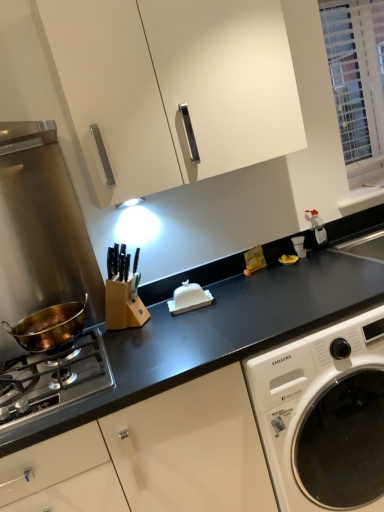
Describe the element at coordinates (174, 87) in the screenshot. Image resolution: width=384 pixels, height=512 pixels. I see `white matte cabinet at upper center` at that location.

Locate an element on the screen. This screenshot has height=512, width=384. bronze metallic wok at left is located at coordinates [49, 326].

This screenshot has width=384, height=512. I want to click on white textured blinds at upper right, so click(x=356, y=82).

What do you see at coordinates (189, 298) in the screenshot? This screenshot has width=384, height=512. I see `white glossy butter dish at center` at bounding box center [189, 298].

I want to click on white matte cabinet at upper center, so click(174, 87).

In the scene shown: Is white glossy washing machine at lower right positioned behind bronze metallic wok at left?

No, white glossy washing machine at lower right is closer to the viewer.

Between white glossy washing machine at lower right and bronze metallic wok at left, which one has smaller width?

bronze metallic wok at left is thinner.

Is white glossy washing machine at lower right oriented towards bronze metallic wok at left?

No, white glossy washing machine at lower right is not oriented towards bronze metallic wok at left.

From a real-world perspective, which is physically above, bronze metallic pan at lower left or white glossy butter dish at center?

white glossy butter dish at center.

Considering the sizes of objects bronze metallic pan at lower left and white glossy butter dish at center in the image provided, who is taller, bronze metallic pan at lower left or white glossy butter dish at center?

Standing taller between the two is white glossy butter dish at center.

Does point (65, 388) appear closer or farther from the camera than point (187, 294)?

Point (65, 388) appears to be closer to the viewer than point (187, 294).

What are the coordinates of `gas stove below the white glossy butter dish at center (from the image's perspective)` in the screenshot? It's located at (53, 380).

Does white glossy butter dish at center appear on the left side of bronze metallic wok at left?

In fact, white glossy butter dish at center is to the right of bronze metallic wok at left.

In the image, is white glossy butter dish at center positioned in front of or behind bronze metallic wok at left?

white glossy butter dish at center is behind bronze metallic wok at left.

Can you confirm if white glossy butter dish at center is shorter than bronze metallic wok at left?

Indeed, white glossy butter dish at center has a lesser height compared to bronze metallic wok at left.

In terms of width, does white glossy butter dish at center look wider or thinner when compared to bronze metallic wok at left?

white glossy butter dish at center is thinner than bronze metallic wok at left.

Is white glossy butter dish at center facing towards white glossy washing machine at lower right?

No, white glossy butter dish at center is not oriented towards white glossy washing machine at lower right.

What's the angular difference between white glossy butter dish at center and white glossy washing machine at lower right's facing directions?

They differ by 10.4 degrees in their facing directions.

Can white glossy washing machine at lower right be found inside white glossy butter dish at center?

No, white glossy washing machine at lower right is not surrounded by white glossy butter dish at center.

In the image, is bronze metallic wok at left positioned in front of or behind bronze metallic pan at lower left?

Clearly, bronze metallic wok at left is behind bronze metallic pan at lower left.

Would you say bronze metallic wok at left is outside bronze metallic pan at lower left?

That's correct, bronze metallic wok at left is outside of bronze metallic pan at lower left.

Identify the location of gas stove in front of the bronze metallic wok at left. (53, 380).

Is bronze metallic wok at left taller than bronze metallic pan at lower left?

Correct, bronze metallic wok at left is much taller as bronze metallic pan at lower left.

What's the angular difference between white matte cabinet at upper center and white glossy washing machine at lower right's facing directions?

white matte cabinet at upper center and white glossy washing machine at lower right are facing 0.235 degrees away from each other.

Between white matte cabinet at upper center and white glossy washing machine at lower right, which one has larger size?

Bigger between the two is white glossy washing machine at lower right.

Is white matte cabinet at upper center not near white glossy washing machine at lower right?

No, white matte cabinet at upper center is not far away from white glossy washing machine at lower right.

Which point is more distant from viewer, (336, 6) or (40, 349)?

The point (336, 6) is more distant.

Is white textured blinds at upper right aimed at bronze metallic wok at left?

No, white textured blinds at upper right is not oriented towards bronze metallic wok at left.

Which object is closer to the camera, white textured blinds at upper right or bronze metallic wok at left?

bronze metallic wok at left is closer to the camera.

This screenshot has width=384, height=512. I want to click on washing machine directly beneath the bronze metallic wok at left (from a real-world perspective), so click(325, 415).

The height and width of the screenshot is (512, 384). In order to click on gas stove on the left side of white glossy butter dish at center in this screenshot , I will do `click(53, 380)`.

When comparing their distances from white matte cabinet at upper center, does white textured blinds at upper right or bronze metallic wok at left seem further?

Among the two, white textured blinds at upper right is located further to white matte cabinet at upper center.

Estimate the real-world distances between objects in this image. Which object is closer to white glossy washing machine at lower right, bronze metallic wok at left or white textured blinds at upper right?

bronze metallic wok at left.

From the picture: Estimate the real-world distances between objects in this image. Which object is further from white glossy butter dish at center, bronze metallic pan at lower left or white matte cabinet at upper center?

white matte cabinet at upper center lies further to white glossy butter dish at center than the other object.

Estimate the real-world distances between objects in this image. Which object is further from bronze metallic pan at lower left, white matte cabinet at upper center or bronze metallic wok at left?

Among the two, white matte cabinet at upper center is located further to bronze metallic pan at lower left.

Looking at the image, which one is located closer to white textured blinds at upper right, white glossy butter dish at center or bronze metallic wok at left?

Among the two, white glossy butter dish at center is located nearer to white textured blinds at upper right.

From the image, which object appears to be nearer to white glossy washing machine at lower right, bronze metallic wok at left or bronze metallic pan at lower left?

Based on the image, bronze metallic pan at lower left appears to be nearer to white glossy washing machine at lower right.

Which object lies further to the anchor point bronze metallic pan at lower left, white matte cabinet at upper center or white glossy butter dish at center?

white matte cabinet at upper center is positioned further to the anchor bronze metallic pan at lower left.

Consider the image. Considering their positions, is white matte cabinet at upper center positioned closer to white glossy butter dish at center than bronze metallic pan at lower left?

bronze metallic pan at lower left is closer to white glossy butter dish at center.

This screenshot has height=512, width=384. Identify the location of gas stove between bronze metallic wok at left and white glossy butter dish at center. (53, 380).

I want to click on appliance between white matte cabinet at upper center and bronze metallic wok at left from top to bottom, so click(189, 298).

Identify the location of appliance situated between bronze metallic pan at lower left and white glossy washing machine at lower right from left to right. The image size is (384, 512). (189, 298).

Identify the location of gas stove between bronze metallic wok at left and white textured blinds at upper right in the horizontal direction. This screenshot has height=512, width=384. (53, 380).